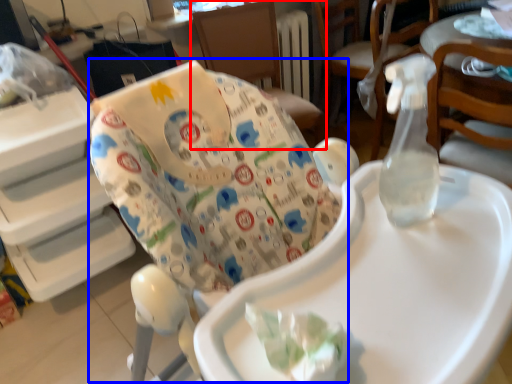
Question: Which point is closer to the camera, chair (highlighted by a red box) or rocking chair (highlighted by a blue box)?

Choices:
 (A) chair
 (B) rocking chair

Answer: (B)